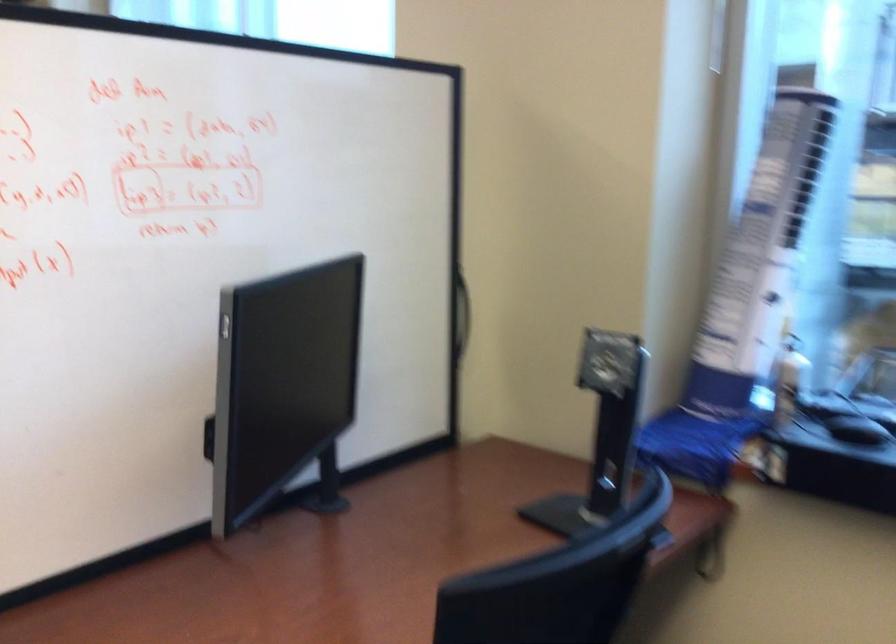
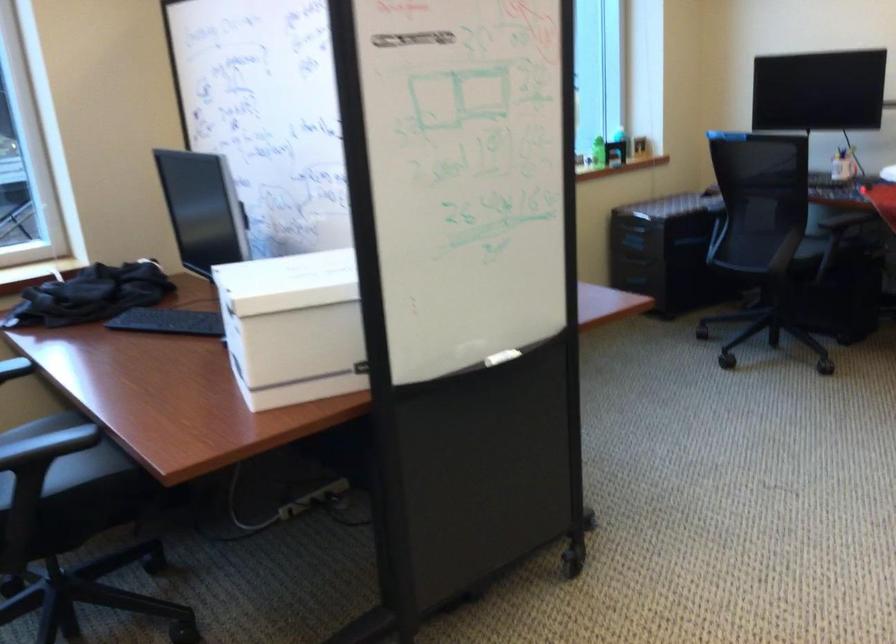
Question: I am providing you with two images of the same scene from different viewpoints. After the viewpoint changes to image2, which objects are now occluded?

Choices:
 (A) small black fan
 (B) rolled up poster
 (C) whiteboard marker tray
 (D) green plastic bottle

Answer: (B)